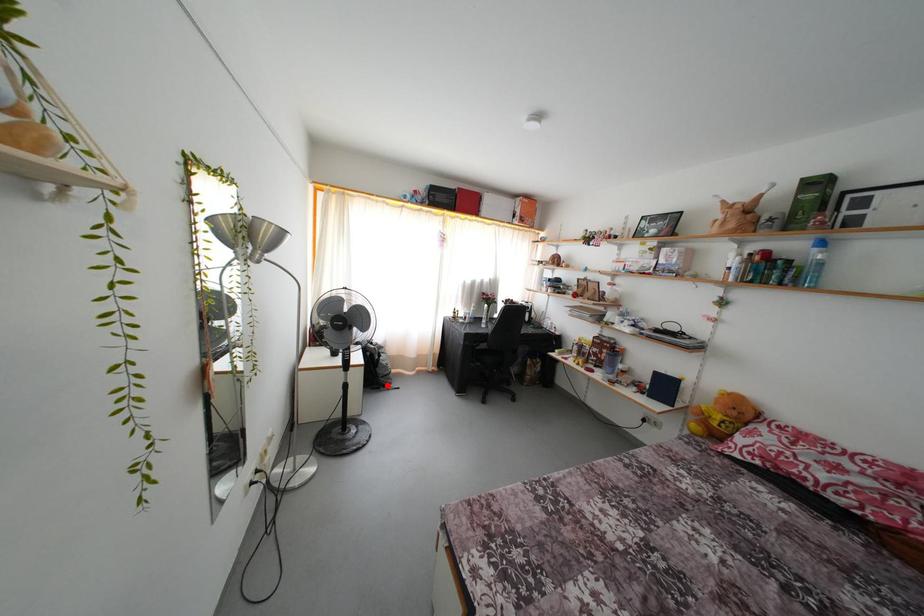
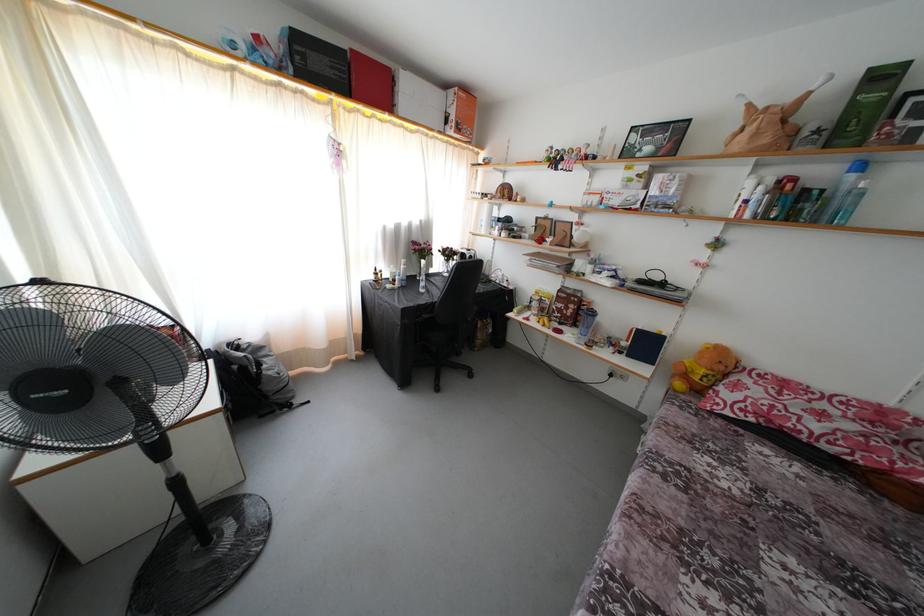
Question: I am providing you with two images of the same scene from different viewpoints. Given a red point in image1, look at the same physical point in image2. Is it:

Choices:
 (A) Closer to the viewpoint
 (B) Farther from the viewpoint

Answer: (A)